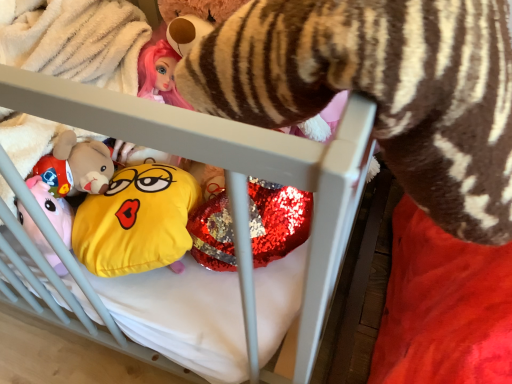
Describe the element at coordinates (228, 164) in the screenshot. Image resolution: width=512 pixels, height=384 pixels. I see `white plastic crib at center` at that location.

Locate an element on the screen. white plastic crib at center is located at coordinates (228, 164).

At what (x,y) coordinates should I click in order to perform the action: click on yellow fabric emoji pillow at center. Please return your answer as a coordinate pair (x, y). The height and width of the screenshot is (384, 512). Looking at the image, I should click on (137, 220).

Describe the element at coordinates (137, 220) in the screenshot. I see `yellow fabric emoji pillow at center` at that location.

At what (x,y) coordinates should I click in order to perform the action: click on white plastic crib at center. Please return your answer as a coordinate pair (x, y). Looking at the image, I should click on (228, 164).

Can you confirm if white plastic crib at center is positioned to the right of yellow fabric emoji pillow at center?

Incorrect, white plastic crib at center is not on the right side of yellow fabric emoji pillow at center.

Does white plastic crib at center come in front of yellow fabric emoji pillow at center?

Yes, white plastic crib at center is in front of yellow fabric emoji pillow at center.

Which is farther from the camera, (321,305) or (87,217)?

Point (87,217)

From the image's perspective, is white plastic crib at center beneath yellow fabric emoji pillow at center?

No.

From a real-world perspective, which is physically below, white plastic crib at center or yellow fabric emoji pillow at center?

From a 3D spatial view, yellow fabric emoji pillow at center is below.

Considering the relative sizes of white plastic crib at center and yellow fabric emoji pillow at center in the image provided, is white plastic crib at center thinner than yellow fabric emoji pillow at center?

No, white plastic crib at center is not thinner than yellow fabric emoji pillow at center.

Between white plastic crib at center and yellow fabric emoji pillow at center, which one has more height?

white plastic crib at center.

Considering the sizes of objects white plastic crib at center and yellow fabric emoji pillow at center in the image provided, who is bigger, white plastic crib at center or yellow fabric emoji pillow at center?

Bigger between the two is white plastic crib at center.

Is yellow fabric emoji pillow at center inside white plastic crib at center?

That's correct, yellow fabric emoji pillow at center is inside white plastic crib at center.

Is white plastic crib at center far away from yellow fabric emoji pillow at center?

white plastic crib at center is near yellow fabric emoji pillow at center, not far away.

Consider the image. Could you tell me if white plastic crib at center is facing yellow fabric emoji pillow at center?

Yes.

In the image, there is a white plastic crib at center. Where is `toy below it (from the image's perspective)`? This screenshot has width=512, height=384. toy below it (from the image's perspective) is located at coordinates (137, 220).

Does yellow fabric emoji pillow at center appear on the right side of white plastic crib at center?

Correct, you'll find yellow fabric emoji pillow at center to the right of white plastic crib at center.

Between yellow fabric emoji pillow at center and white plastic crib at center, which one is positioned behind?

Positioned behind is yellow fabric emoji pillow at center.

Is point (79, 210) farther from camera compared to point (325, 182)?

Yes, it is.

From the image's perspective, is yellow fabric emoji pillow at center under white plastic crib at center?

Correct, yellow fabric emoji pillow at center appears lower than white plastic crib at center in the image.

From a real-world perspective, is yellow fabric emoji pillow at center on white plastic crib at center?

Actually, yellow fabric emoji pillow at center is physically below white plastic crib at center in the real world.

Between yellow fabric emoji pillow at center and white plastic crib at center, which one has smaller width?

Thinner between the two is yellow fabric emoji pillow at center.

Is yellow fabric emoji pillow at center taller or shorter than white plastic crib at center?

Considering their sizes, yellow fabric emoji pillow at center has less height than white plastic crib at center.

Considering the relative sizes of yellow fabric emoji pillow at center and white plastic crib at center in the image provided, is yellow fabric emoji pillow at center smaller than white plastic crib at center?

Yes, yellow fabric emoji pillow at center is smaller than white plastic crib at center.

Is yellow fabric emoji pillow at center outside of white plastic crib at center?

No, yellow fabric emoji pillow at center is inside white plastic crib at center's boundary.

Are yellow fabric emoji pillow at center and white plastic crib at center located far from each other?

No, yellow fabric emoji pillow at center is in close proximity to white plastic crib at center.

Is yellow fabric emoji pillow at center aimed at white plastic crib at center?

Yes, yellow fabric emoji pillow at center is turned towards white plastic crib at center.

Where is `toy below the white plastic crib at center (from the image's perspective)`? The image size is (512, 384). toy below the white plastic crib at center (from the image's perspective) is located at coordinates (137, 220).

Locate an element on the screen. Image resolution: width=512 pixels, height=384 pixels. toy behind the white plastic crib at center is located at coordinates (137, 220).

You are a GUI agent. You are given a task and a screenshot of the screen. Output one action in this format:
    pyautogui.click(x=<x>, y=<y>)
    Task: Click on the toy that appears below the white plastic crib at center (from the image's perspective)
    
    Given the screenshot: What is the action you would take?
    pyautogui.click(x=137, y=220)